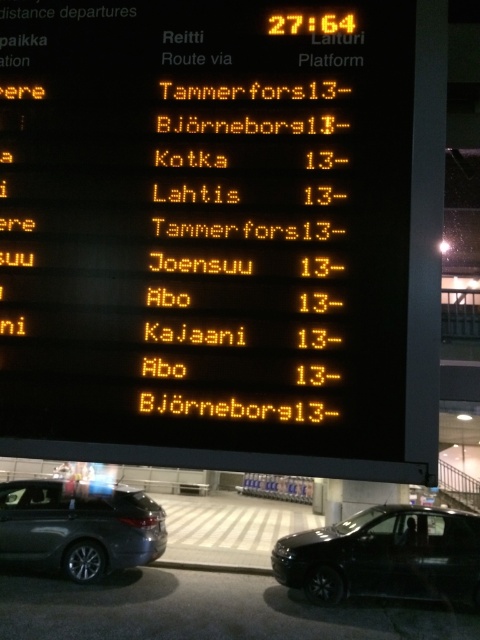
Question: From the image, what is the correct spatial relationship of black glossy car at lower right in relation to metallic gray sedan at lower left?

Choices:
 (A) right
 (B) left

Answer: (A)

Question: Which point is farther to the camera?

Choices:
 (A) (190, 204)
 (B) (440, 584)
 (C) (130, 554)

Answer: (C)

Question: Which object is the closest to the black glossy car at lower right?

Choices:
 (A) metallic gray sedan at lower left
 (B) yellow led display at center

Answer: (A)

Question: Which of these objects is positioned farthest from the black glossy car at lower right?

Choices:
 (A) yellow led display at center
 (B) metallic gray sedan at lower left

Answer: (A)

Question: Is yellow led display at center wider than metallic gray sedan at lower left?

Choices:
 (A) no
 (B) yes

Answer: (A)

Question: From the image, what is the correct spatial relationship of yellow led display at center in relation to black glossy car at lower right?

Choices:
 (A) right
 (B) left

Answer: (B)